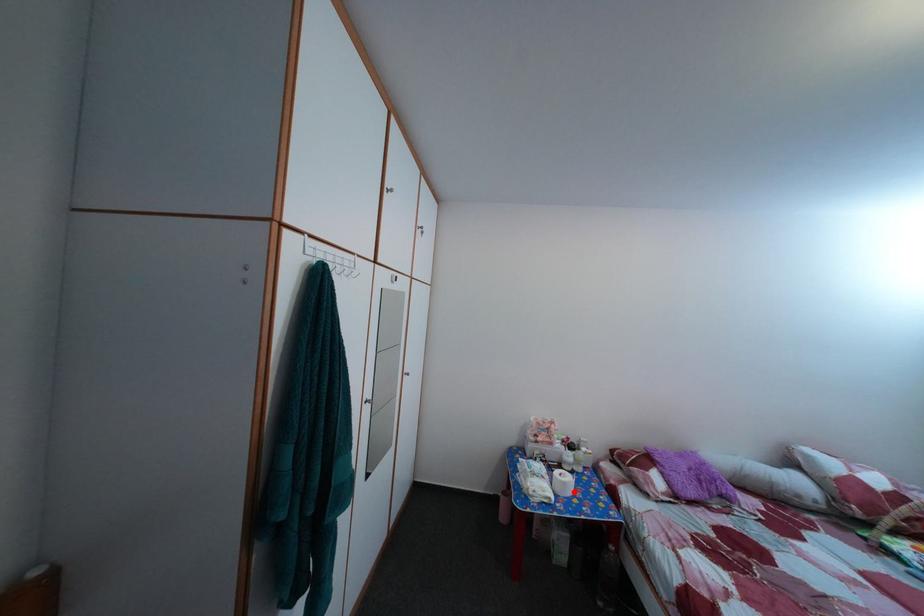
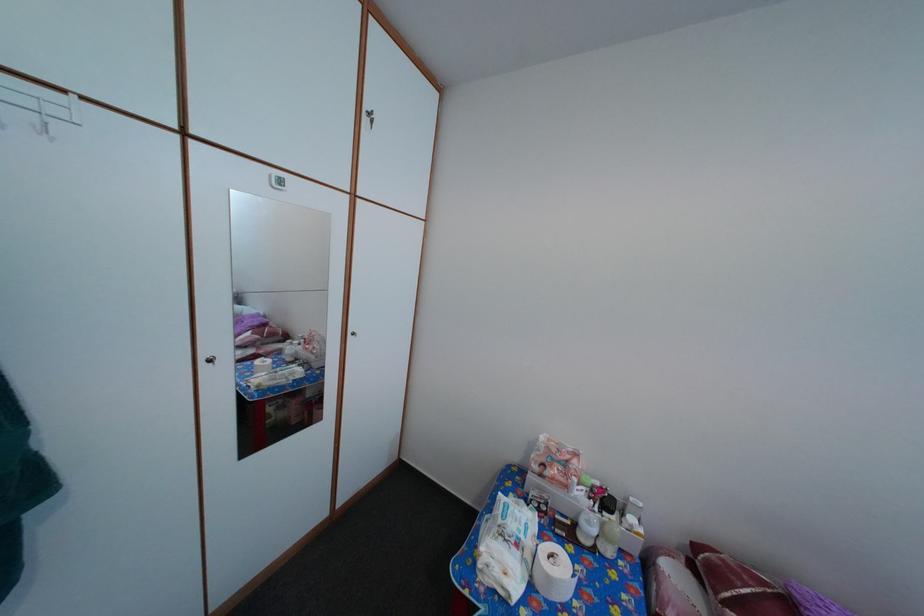
Find the pixel in the second image that matches the highlighted location in the first image.

(558, 586)